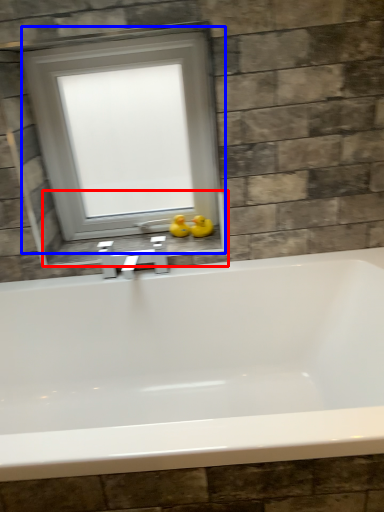
Question: Which point is closer to the camera, window sill (highlighted by a red box) or window (highlighted by a blue box)?

Choices:
 (A) window sill
 (B) window

Answer: (B)